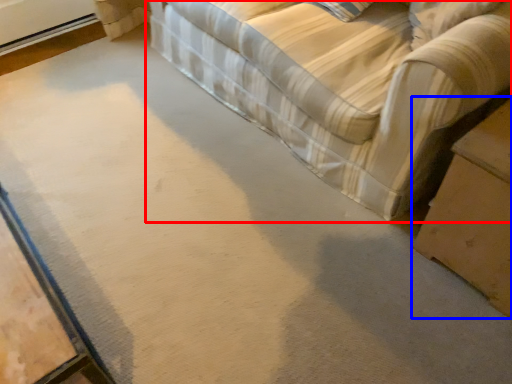
Question: Which of the following is the closest to the observer, studio couch (highlighted by a red box) or table (highlighted by a blue box)?

Choices:
 (A) studio couch
 (B) table

Answer: (A)